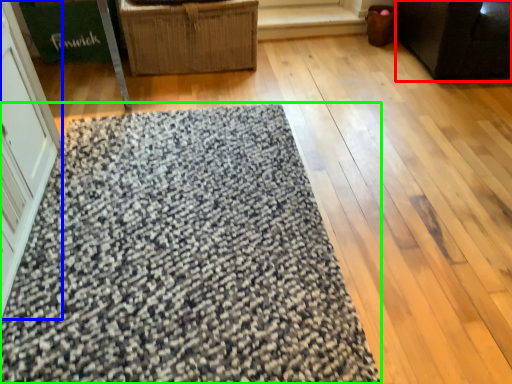
Question: Which is farther away from furniture (highlighted by a red box)? screen door (highlighted by a blue box) or mat (highlighted by a green box)?

Choices:
 (A) screen door
 (B) mat

Answer: (A)